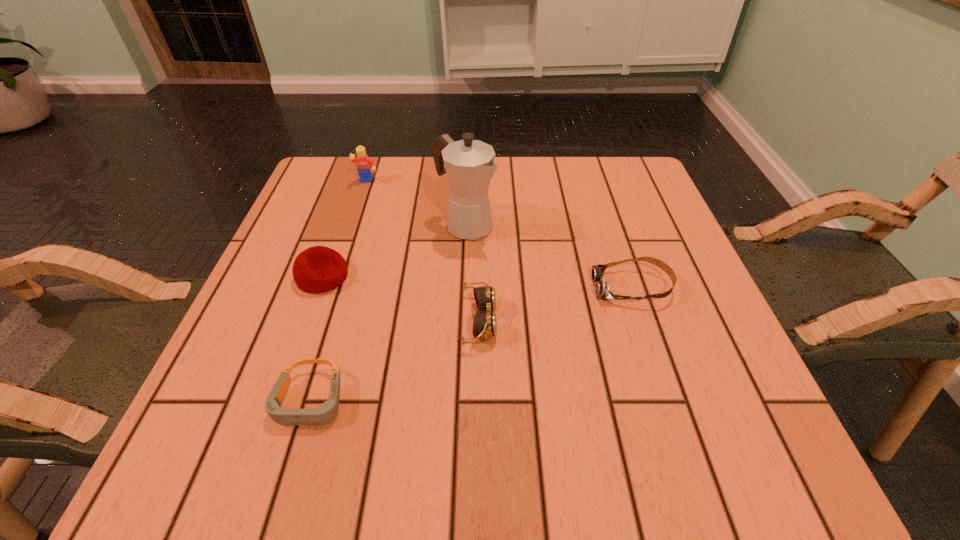
Locate an element on the screen. The image size is (960, 540). vacant space at the near left corner of the desktop is located at coordinates (249, 439).

Find the location of a particular element. vacant space at the far right corner of the desktop is located at coordinates (588, 191).

At what (x,y) coordinates should I click in order to perform the action: click on vacant region between the tallest object and the second tallest object. Please return your answer as a coordinate pair (x, y). Looking at the image, I should click on (416, 203).

Locate an element on the screen. unoccupied position between the second goggles from right to left and the rightmost goggles is located at coordinates click(556, 304).

I want to click on vacant point located between the leftmost goggles and the second goggles from right to left, so click(395, 361).

The height and width of the screenshot is (540, 960). In order to click on free space between the beanbag and the fifth nearest object in this screenshot , I will do `click(394, 250)`.

I want to click on empty space that is in between the beanbag and the coffeepot, so click(394, 250).

Locate an element on the screen. Image resolution: width=960 pixels, height=540 pixels. free spot between the farthest object and the coffeepot is located at coordinates (x=416, y=203).

Where is `empty space between the coffeepot and the beanbag`? Image resolution: width=960 pixels, height=540 pixels. empty space between the coffeepot and the beanbag is located at coordinates (394, 250).

The width and height of the screenshot is (960, 540). What are the coordinates of `empty space between the second tallest object and the beanbag` in the screenshot? It's located at (345, 229).